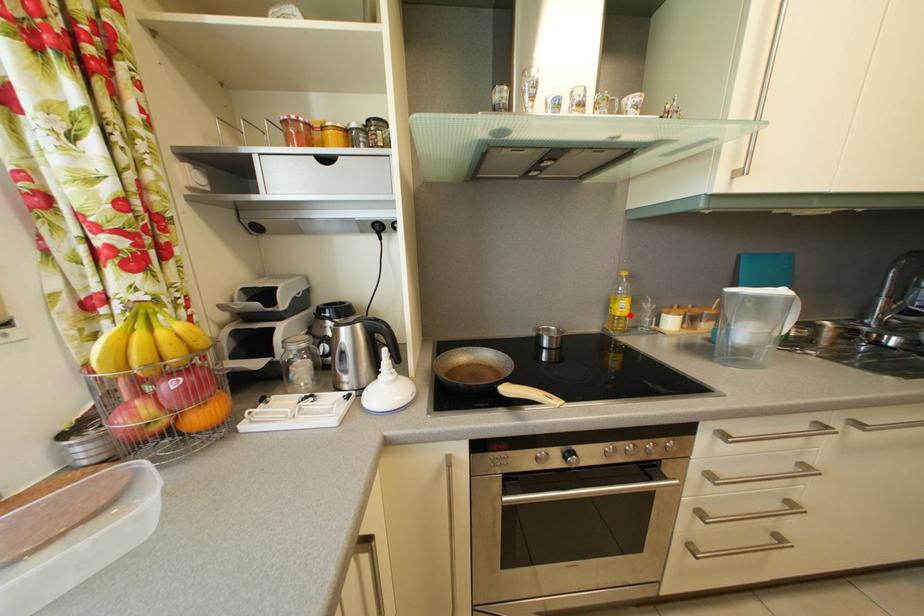
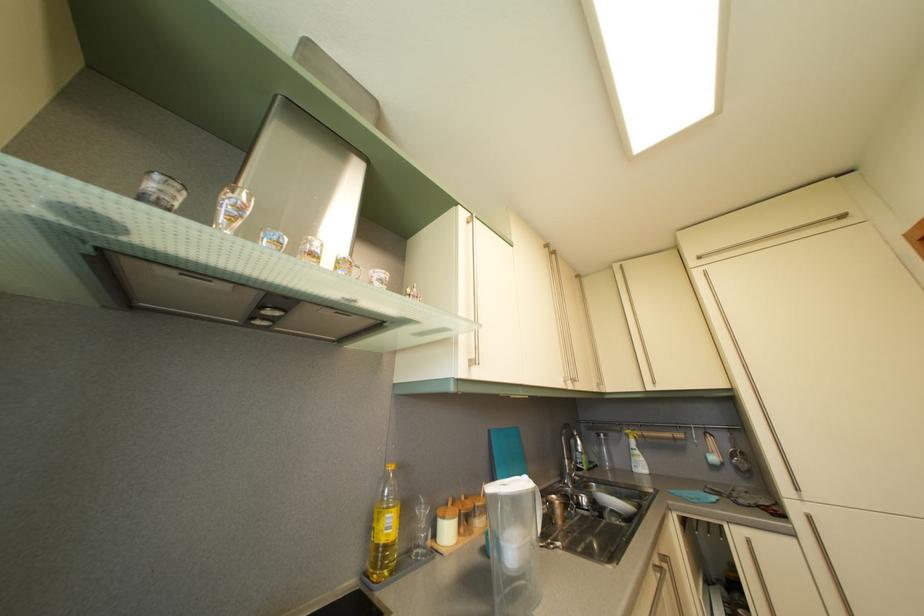
Find the pixel in the second image that matches the highlighted location in the first image.

(396, 533)